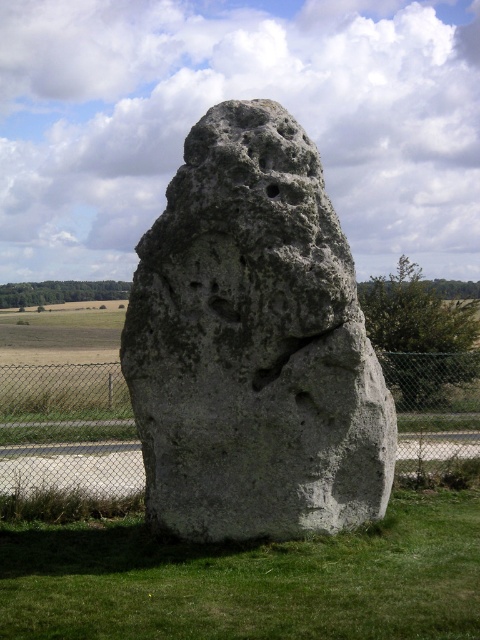
How much distance is there between green grass at lower center and metal chain-link fence at center?

The distance of green grass at lower center from metal chain-link fence at center is 3.42 meters.

Is green grass at lower center closer to camera compared to metal chain-link fence at center?

Yes, green grass at lower center is closer to the viewer.

Who is more distant from viewer, (23, 566) or (111, 419)?

Positioned behind is point (111, 419).

At what (x,y) coordinates should I click in order to perform the action: click on green grass at lower center. Please return your answer as a coordinate pair (x, y). The width and height of the screenshot is (480, 640). Looking at the image, I should click on (249, 579).

Who is lower down, gray rough stone at center or metal chain-link fence at center?

Positioned lower is metal chain-link fence at center.

Does gray rough stone at center have a smaller size compared to metal chain-link fence at center?

Yes, gray rough stone at center is smaller than metal chain-link fence at center.

Who is more forward, (207, 474) or (399, 460)?

Positioned in front is point (207, 474).

Where is `gray rough stone at center`? This screenshot has width=480, height=640. gray rough stone at center is located at coordinates (253, 344).

Does gray rough stone at center have a greater height compared to green grass at lower center?

Yes.

Does point (338, 234) come closer to viewer compared to point (348, 566)?

No, it is behind (348, 566).

I want to click on gray rough stone at center, so click(253, 344).